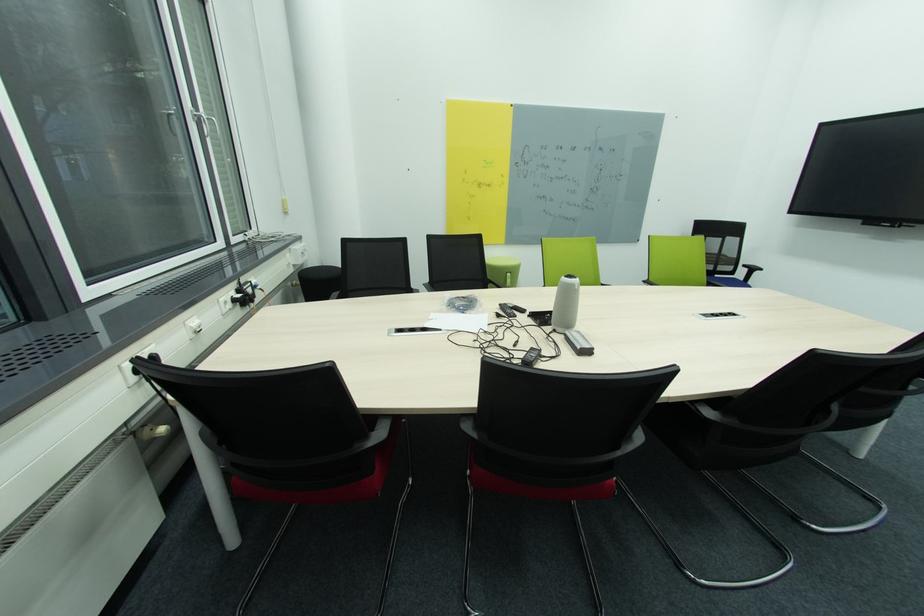
I want to click on black chair sitting surface, so click(533, 488).